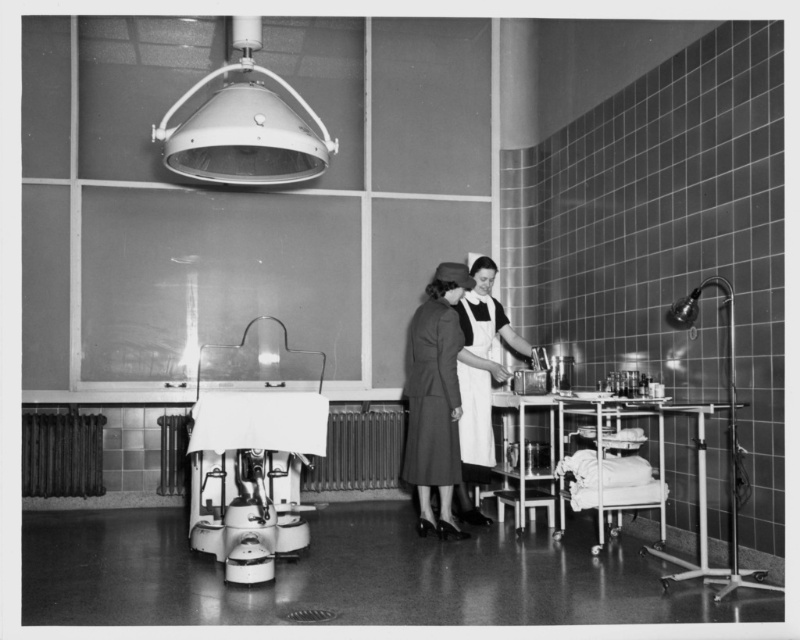
Question: Which of the following is the farthest from the observer?

Choices:
 (A) white apron at center
 (B) metallic gray machine at center

Answer: (A)

Question: Considering the real-world distances, which object is closest to the dark gray fabric coat at center?

Choices:
 (A) metallic adjustable lamp at right
 (B) metallic gray machine at center
 (C) white fabric-covered bed at lower right

Answer: (B)

Question: Which point appears farthest from the camera in this image?

Choices:
 (A) (214, 161)
 (B) (484, 397)
 (C) (616, 422)
 (D) (730, 577)

Answer: (B)

Question: Can you confirm if white fabric-covered bed at lower right is wider than metallic adjustable lamp at right?

Choices:
 (A) yes
 (B) no

Answer: (A)

Question: Does metallic gray machine at center appear on the right side of white fabric-covered bed at lower right?

Choices:
 (A) yes
 (B) no

Answer: (B)

Question: Is dark gray fabric coat at center closer to camera compared to white cotton apron at center?

Choices:
 (A) no
 (B) yes

Answer: (B)